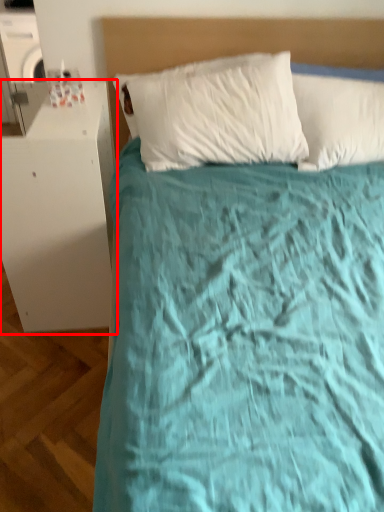
Question: From the image's perspective, where is table (annotated by the red box) located in relation to headboard in the image?

Choices:
 (A) above
 (B) below

Answer: (B)